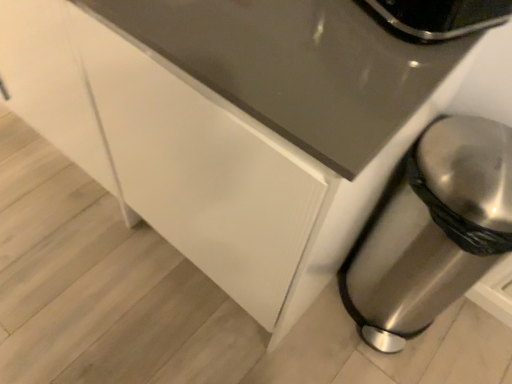
At what (x,y) coordinates should I click in order to perform the action: click on polished stainless steel trash can at lower right. Please return your answer as a coordinate pair (x, y). Looking at the image, I should click on (432, 231).

What do you see at coordinates (432, 231) in the screenshot? I see `polished stainless steel trash can at lower right` at bounding box center [432, 231].

The width and height of the screenshot is (512, 384). I want to click on polished stainless steel trash can at lower right, so click(x=432, y=231).